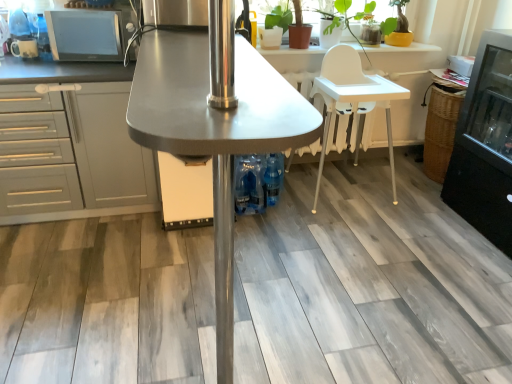
This screenshot has width=512, height=384. I want to click on vacant point to the right of blue plastic bottles at center, so click(295, 207).